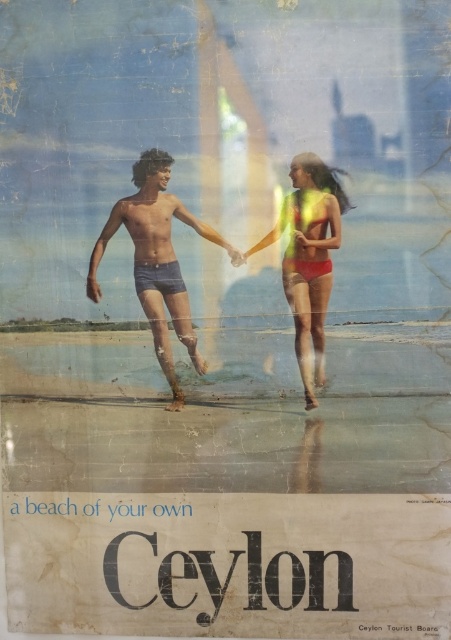
Who is higher up, blue denim shorts at center or matte yellow bikini at center?

Positioned higher is blue denim shorts at center.

Does blue denim shorts at center lie behind matte yellow bikini at center?

Yes.

Which is in front, point (165, 291) or point (341, 202)?

Point (341, 202)

Find the location of a particular element. This screenshot has height=640, width=451. blue denim shorts at center is located at coordinates (157, 260).